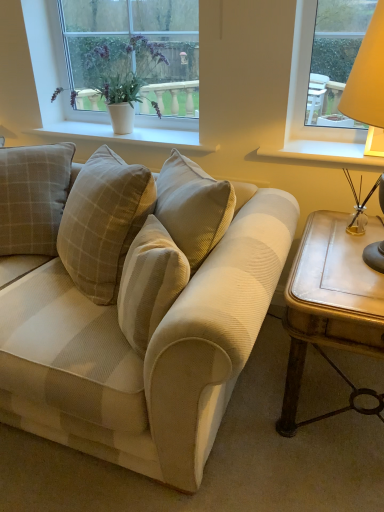
Image resolution: width=384 pixels, height=512 pixels. I want to click on white ceramic pot at upper left, so click(x=94, y=73).

Measure the distance between beige corduroy couch at center and camera.

They are 37.88 inches apart.

In order to click on white ceramic pot at upper left in this screenshot , I will do `click(121, 95)`.

Describe the element at coordinates (330, 301) in the screenshot. I see `metallic gold table at right` at that location.

You are a GUI agent. You are given a task and a screenshot of the screen. Output one action in this format:
    pyautogui.click(x=<x>, y=<y>)
    Task: Click on the matte yellow lampshade at right
    
    Given the screenshot: What is the action you would take?
    pyautogui.click(x=367, y=76)

The width and height of the screenshot is (384, 512). Describe the element at coordinates (367, 76) in the screenshot. I see `matte yellow lampshade at right` at that location.

Measure the distance between point (367, 165) and camera.

They are 5.52 feet apart.

The image size is (384, 512). Describe the element at coordinates (125, 136) in the screenshot. I see `white textured pot at upper center, which is counted as the second window sill, starting from the right` at that location.

I want to click on white ceramic pot at upper left, so click(94, 73).

Considering the positions of points (115, 115) and (101, 322), is point (115, 115) farther from camera compared to point (101, 322)?

Yes, it is.

Which object is more forward, white ceramic pot at upper left or beige corduroy couch at center?

beige corduroy couch at center is in front.

Is white ceramic pot at upper left with beige corduroy couch at center?

No, white ceramic pot at upper left is not making contact with beige corduroy couch at center.

In terms of height, does matte yellow lampshade at right look taller or shorter compared to white ceramic pot at upper left?

Clearly, matte yellow lampshade at right is taller compared to white ceramic pot at upper left.

Looking at this image, between matte yellow lampshade at right and white ceramic pot at upper left, which one has larger size?

Bigger between the two is matte yellow lampshade at right.

Looking at their sizes, would you say matte yellow lampshade at right is wider or thinner than white ceramic pot at upper left?

Considering their sizes, matte yellow lampshade at right looks broader than white ceramic pot at upper left.

How far apart are matte yellow lampshade at right and white ceramic pot at upper left?

They are 4.20 feet apart.

Consider the image. Is metallic gold table at right bigger than white textured pot at upper center, which is counted as the second window sill, starting from the right?

Correct, metallic gold table at right is larger in size than white textured pot at upper center, which is counted as the second window sill, starting from the right.

From the image's perspective, is metallic gold table at right above white textured pot at upper center, which is counted as the second window sill, starting from the right?

No, from the image's perspective, metallic gold table at right is not above white textured pot at upper center, which is counted as the second window sill, starting from the right.

In terms of width, does metallic gold table at right look wider or thinner when compared to white textured pot at upper center, marked as the first window sill in a left-to-right arrangement?

Considering their sizes, metallic gold table at right looks broader than white textured pot at upper center, marked as the first window sill in a left-to-right arrangement.

Could you tell me if white textured pot at upper center, which is counted as the second window sill, starting from the right, is turned towards white painted wood at right, the 1th window sill viewed from the right?

No, white textured pot at upper center, which is counted as the second window sill, starting from the right, is not oriented towards white painted wood at right, the 1th window sill viewed from the right.

From the picture: Which is closer, (84, 137) or (355, 162)?

Point (84, 137) is farther from the camera than point (355, 162).

Considering the sizes of white textured pot at upper center, marked as the first window sill in a left-to-right arrangement, and white painted wood at right, the 1th window sill viewed from the right, in the image, is white textured pot at upper center, marked as the first window sill in a left-to-right arrangement, taller or shorter than white painted wood at right, the 1th window sill viewed from the right,?

white textured pot at upper center, marked as the first window sill in a left-to-right arrangement, is taller than white painted wood at right, the 1th window sill viewed from the right.

From a real-world perspective, which object rests below the other?

white painted wood at right, the 1th window sill viewed from the right.

At what (x,y) coordinates should I click in order to perform the action: click on table that is in front of the white ceramic pot at upper left. Please return your answer as a coordinate pair (x, y). Looking at the image, I should click on (330, 301).

From the image's perspective, which one is positioned higher, metallic gold table at right or white ceramic pot at upper left?

white ceramic pot at upper left appears higher in the image.

Is metallic gold table at right inside the boundaries of white ceramic pot at upper left, or outside?

metallic gold table at right is not inside white ceramic pot at upper left, it's outside.

Is metallic gold table at right positioned with its back to white ceramic pot at upper left?

That's not correct — metallic gold table at right is not looking away from white ceramic pot at upper left.

Is white textured pot at upper center, marked as the first window sill in a left-to-right arrangement, inside beige corduroy pillow at center?

Definitely not — white textured pot at upper center, marked as the first window sill in a left-to-right arrangement, is not inside beige corduroy pillow at center.

Would you say beige corduroy pillow at center is to the left or to the right of white textured pot at upper center, marked as the first window sill in a left-to-right arrangement, in the picture?

→ Based on their positions, beige corduroy pillow at center is located to the left of white textured pot at upper center, marked as the first window sill in a left-to-right arrangement.

Between beige corduroy pillow at center and white textured pot at upper center, marked as the first window sill in a left-to-right arrangement, which one has less height?

white textured pot at upper center, marked as the first window sill in a left-to-right arrangement, is shorter.

How far apart are white painted wood at right, the 1th window sill viewed from the right, and beige corduroy couch at center?

white painted wood at right, the 1th window sill viewed from the right, and beige corduroy couch at center are 32.74 inches apart from each other.

Which object is further away from the camera, white painted wood at right, acting as the second window sill starting from the left, or beige corduroy couch at center?

white painted wood at right, acting as the second window sill starting from the left, is further away from the camera.

Is beige corduroy couch at center at the back of white painted wood at right, acting as the second window sill starting from the left?

white painted wood at right, acting as the second window sill starting from the left, is not turned away from beige corduroy couch at center.

Is white painted wood at right, the 1th window sill viewed from the right, at the left side of beige corduroy couch at center?

No, white painted wood at right, the 1th window sill viewed from the right, is not to the left of beige corduroy couch at center.

Find the location of a particular element. The width and height of the screenshot is (384, 512). studio couch located on the left of white ceramic pot at upper left is located at coordinates (136, 307).

You are a GUI agent. You are given a task and a screenshot of the screen. Output one action in this format:
    pyautogui.click(x=<x>, y=<y>)
    Task: Click on the window located above the matte yellow lampshade at right (from a real-world perspective)
    The height and width of the screenshot is (512, 384).
    Given the screenshot: What is the action you would take?
    pyautogui.click(x=94, y=73)

In the scene shown: From the image, which object appears to be nearer to white ceramic pot at upper left, metallic gold table at right or white painted wood at right, the 1th window sill viewed from the right?

white painted wood at right, the 1th window sill viewed from the right.

Looking at the image, which one is located further to white ceramic pot at upper left, beige corduroy pillow at center or matte yellow lampshade at right?

Among the two, matte yellow lampshade at right is located further to white ceramic pot at upper left.

When comparing their distances from white painted wood at right, acting as the second window sill starting from the left, does metallic gold table at right or white ceramic pot at upper left seem further?

Based on the image, white ceramic pot at upper left appears to be further to white painted wood at right, acting as the second window sill starting from the left.

Which object lies nearer to the anchor point white painted wood at right, acting as the second window sill starting from the left, white ceramic pot at upper left or metallic gold table at right?

metallic gold table at right is closer to white painted wood at right, acting as the second window sill starting from the left.

Considering their positions, is white painted wood at right, the 1th window sill viewed from the right, positioned further to matte yellow lampshade at right than white textured pot at upper center, which is counted as the second window sill, starting from the right?

white textured pot at upper center, which is counted as the second window sill, starting from the right, is further to matte yellow lampshade at right.

When comparing their distances from beige corduroy couch at center, does white ceramic pot at upper left or white ceramic pot at upper left seem closer?

white ceramic pot at upper left.

Based on their spatial positions, is white painted wood at right, the 1th window sill viewed from the right, or white ceramic pot at upper left closer to white textured pot at upper center, marked as the first window sill in a left-to-right arrangement?

white ceramic pot at upper left lies closer to white textured pot at upper center, marked as the first window sill in a left-to-right arrangement, than the other object.

Which object lies nearer to the anchor point white ceramic pot at upper left, matte yellow lampshade at right or beige corduroy couch at center?

beige corduroy couch at center lies closer to white ceramic pot at upper left than the other object.

Locate an element on the screen. table lamp between beige corduroy pillow at center and white painted wood at right, acting as the second window sill starting from the left, in the horizontal direction is located at coordinates click(x=367, y=76).

Locate an element on the screen. This screenshot has height=512, width=384. pillow between beige corduroy couch at center and white ceramic pot at upper left from front to back is located at coordinates (33, 197).

In order to click on table lamp between beige corduroy couch at center and metallic gold table at right in the horizontal direction in this screenshot , I will do `click(367, 76)`.

I want to click on studio couch situated between beige corduroy pillow at center and metallic gold table at right from left to right, so click(136, 307).